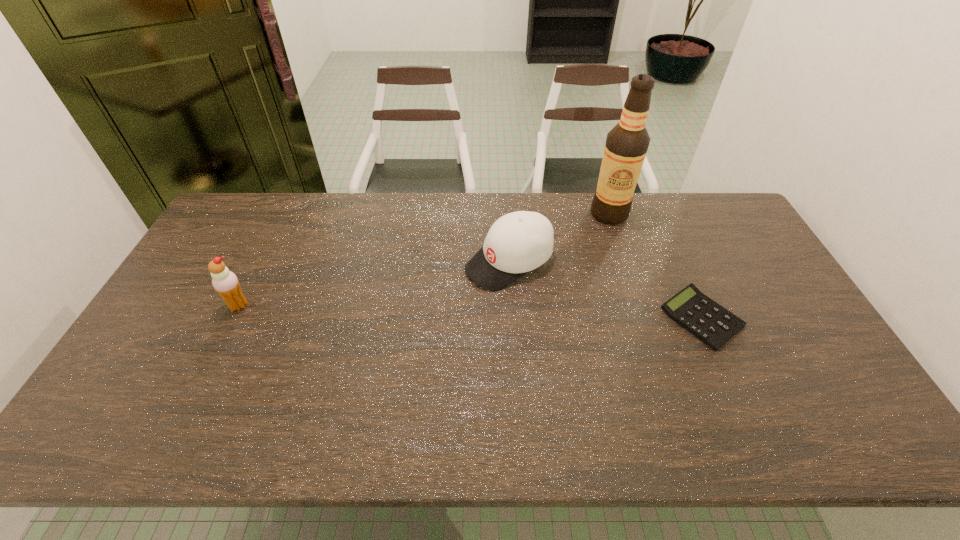
Identify the location of free location located 0.260m on the front-facing side of the baseball cap. This screenshot has width=960, height=540. (399, 320).

In order to click on blank space located 0.290m on the front-facing side of the baseball cap in this screenshot , I will do `click(391, 326)`.

This screenshot has height=540, width=960. Find the location of `vacant space located on the label of the alcohol`. vacant space located on the label of the alcohol is located at coordinates (555, 279).

The image size is (960, 540). Identify the location of free space located on the label of the alcohol. (588, 239).

Image resolution: width=960 pixels, height=540 pixels. I want to click on vacant space located 0.360m on the label of the alcohol, so click(x=550, y=285).

Find the location of a particular element. Image resolution: width=960 pixels, height=540 pixels. object at the far edge is located at coordinates (626, 145).

Where is `vacant space at the far edge of the desktop`? vacant space at the far edge of the desktop is located at coordinates (692, 224).

In the image, there is a desktop. Identify the location of vacant region at the near edge. (735, 380).

Find the location of `free region at the far left corner of the desktop`. free region at the far left corner of the desktop is located at coordinates (228, 218).

This screenshot has width=960, height=540. What are the coordinates of `free point at the near left corner` in the screenshot? It's located at (166, 375).